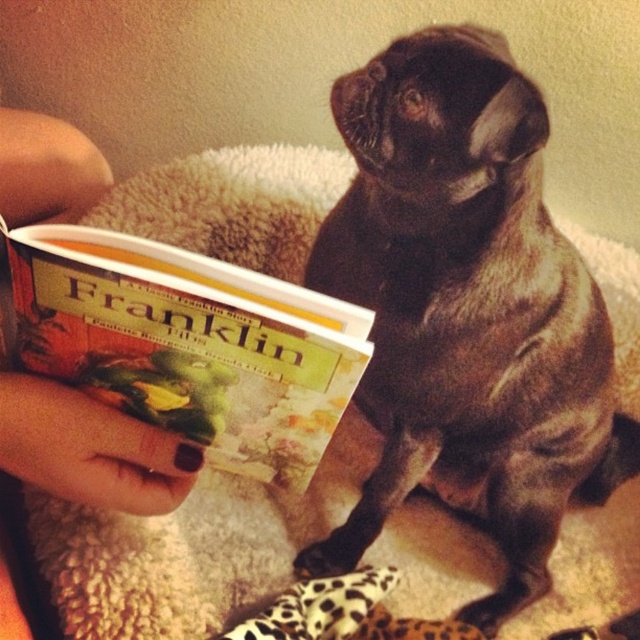
You are a visitor in this room and want to know if the brown furry dog at center can fit under a low table that is the same height as the nail polish at upper left. Can it?

The brown furry dog at center is taller than the nail polish at upper left, so it cannot fit under the table since the table height is the same as the nail polish.

You are a toy manufacturer designing a playset that includes both the brown furry dog at center and the hardcover book at upper left. To ensure compatibility, you need to know which item is taller. Can you determine which one is taller?

The brown furry dog at center is taller than the hardcover book at upper left according to the description.